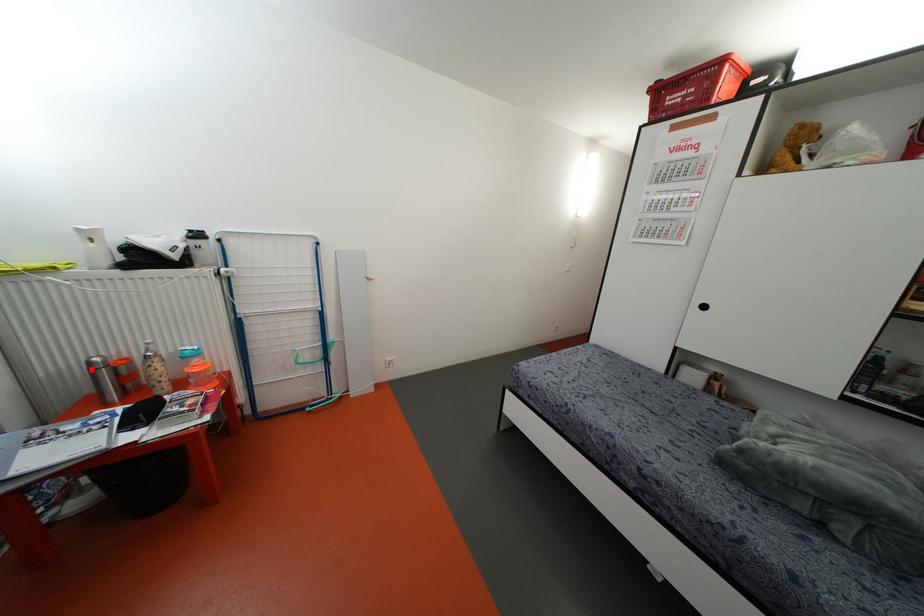
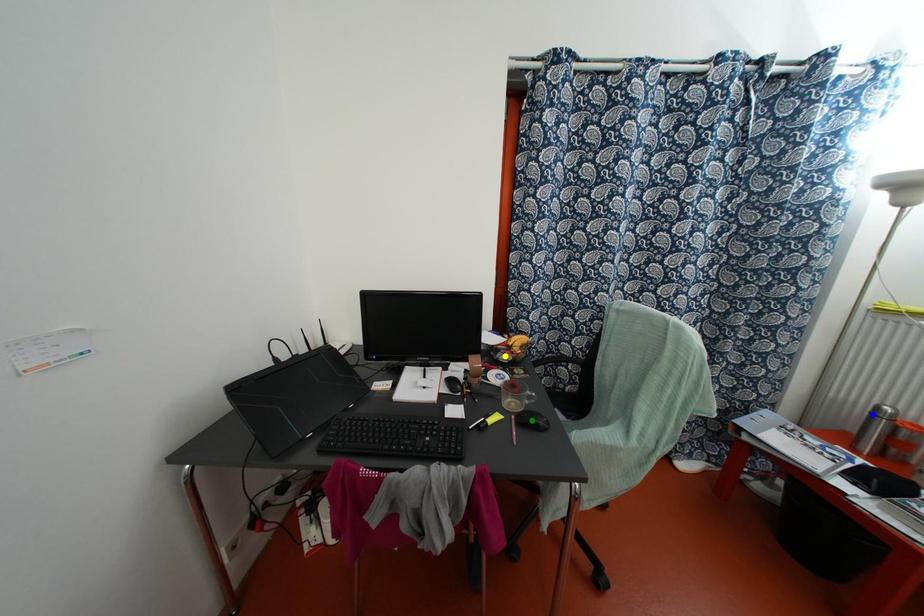
Question: I am providing you with two images of the same scene from different viewpoints. A red point is marked on the first image. You are given multiple points on the second image. Which point in image 2 represents the same 3d spot as the red point in image 1?

Choices:
 (A) green point
 (B) blue point
 (C) yellow point

Answer: (B)